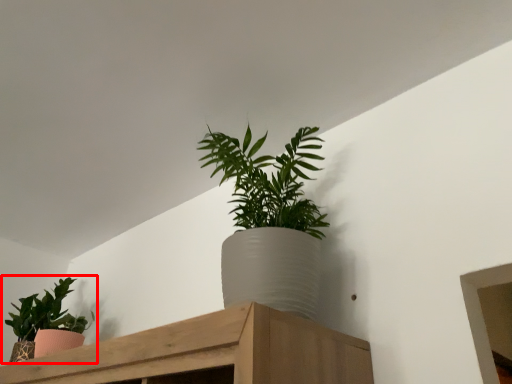
Question: From the image's perspective, considering the relative positions of houseplant (annotated by the red box) and houseplant in the image provided, where is houseplant (annotated by the red box) located with respect to the staircase?

Choices:
 (A) above
 (B) below

Answer: (B)